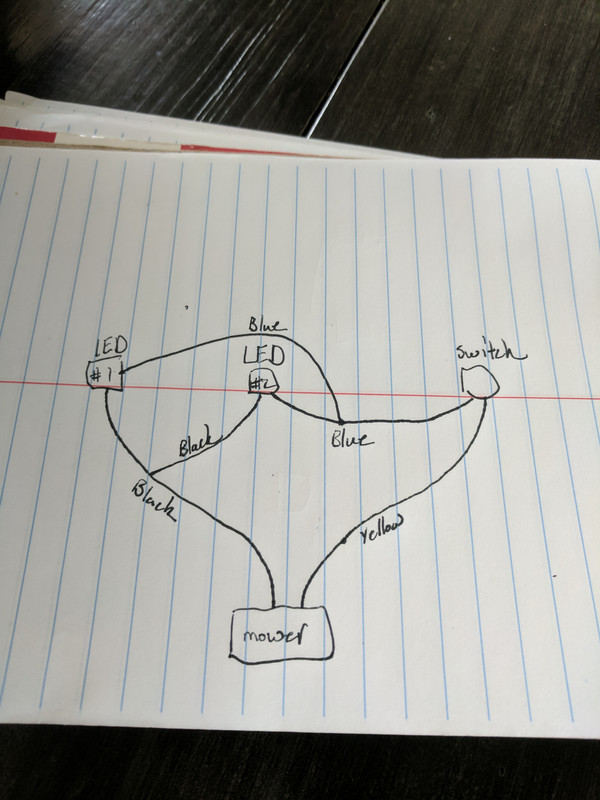
You are a GUI agent. You are given a task and a screenshot of the screen. Output one action in this format:
    pyautogui.click(x=<x>, y=<y>)
    Task: Click on the tabletop
    This screenshot has height=800, width=600.
    Given the screenshot: What is the action you would take?
    pyautogui.click(x=424, y=62)